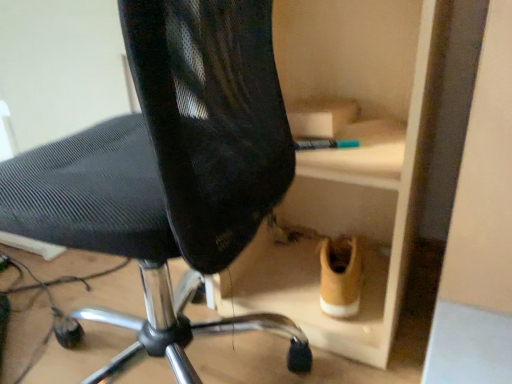
Question: Does tan suede sneaker at lower right appear on the left side of black mesh chair at center?

Choices:
 (A) yes
 (B) no

Answer: (B)

Question: Does tan suede sneaker at lower right have a lesser height compared to black mesh chair at center?

Choices:
 (A) no
 (B) yes

Answer: (B)

Question: Is tan suede sneaker at lower right outside of black mesh chair at center?

Choices:
 (A) no
 (B) yes

Answer: (B)

Question: Would you say tan suede sneaker at lower right is a long distance from black mesh chair at center?

Choices:
 (A) no
 (B) yes

Answer: (A)

Question: Does tan suede sneaker at lower right come in front of black mesh chair at center?

Choices:
 (A) yes
 (B) no

Answer: (B)

Question: Can you confirm if tan suede sneaker at lower right is positioned to the right of black mesh chair at center?

Choices:
 (A) no
 (B) yes

Answer: (B)

Question: Could you tell me if black mesh chair at center is turned towards tan suede sneaker at lower right?

Choices:
 (A) no
 (B) yes

Answer: (A)

Question: Is black mesh chair at center to the right of tan suede sneaker at lower right from the viewer's perspective?

Choices:
 (A) no
 (B) yes

Answer: (A)

Question: Is black mesh chair at center touching tan suede sneaker at lower right?

Choices:
 (A) yes
 (B) no

Answer: (B)

Question: Is tan suede sneaker at lower right at the back of black mesh chair at center?

Choices:
 (A) yes
 (B) no

Answer: (B)

Question: Does black mesh chair at center have a greater width compared to tan suede sneaker at lower right?

Choices:
 (A) yes
 (B) no

Answer: (A)

Question: Is black mesh chair at center surrounding tan suede sneaker at lower right?

Choices:
 (A) yes
 (B) no

Answer: (B)

Question: Visually, is tan suede sneaker at lower right positioned to the left or to the right of black mesh chair at center?

Choices:
 (A) right
 (B) left

Answer: (A)